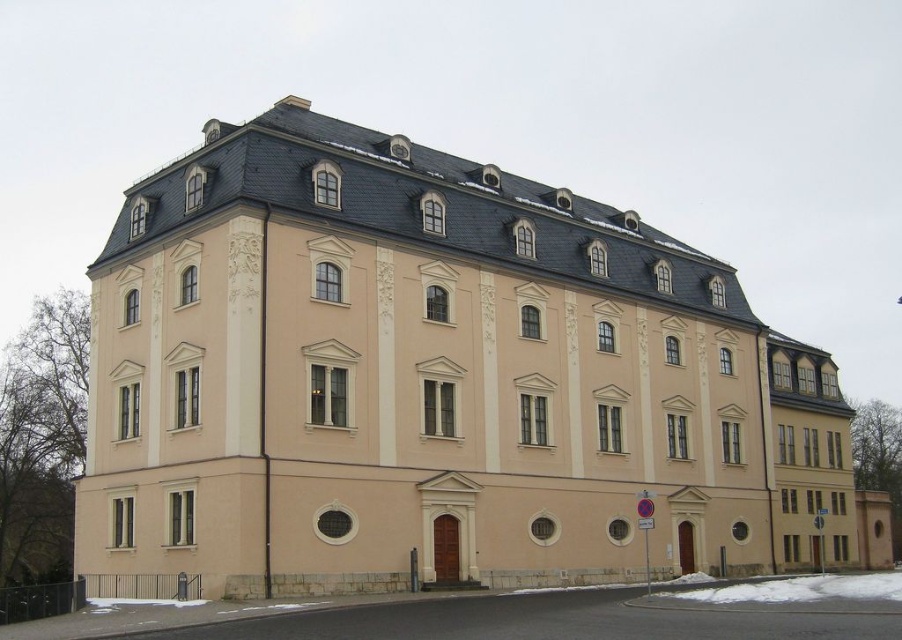
Based on the scene description, can you determine if the beige stone building at center is wider than the white powdery snow at lower center?

The beige stone building at center might be wider than white powdery snow at lower center according to the objects description.

You are standing in front of the building and want to take a photo. You notice two points on the building, one at point coordinates point (253, 400) and another at point (857, 586). Which point will appear larger in your camera view?

Point (253, 400) is closer to the camera than point (857, 586), so it will appear larger in the camera view.

Based on the scene description, which object occupies a larger area in the image? Please choose between the beige stone building at center and the white powdery snow at lower center.

The beige stone building at center is bigger than the white powdery snow at lower center, so the beige stone building at center occupies a larger area in the image.